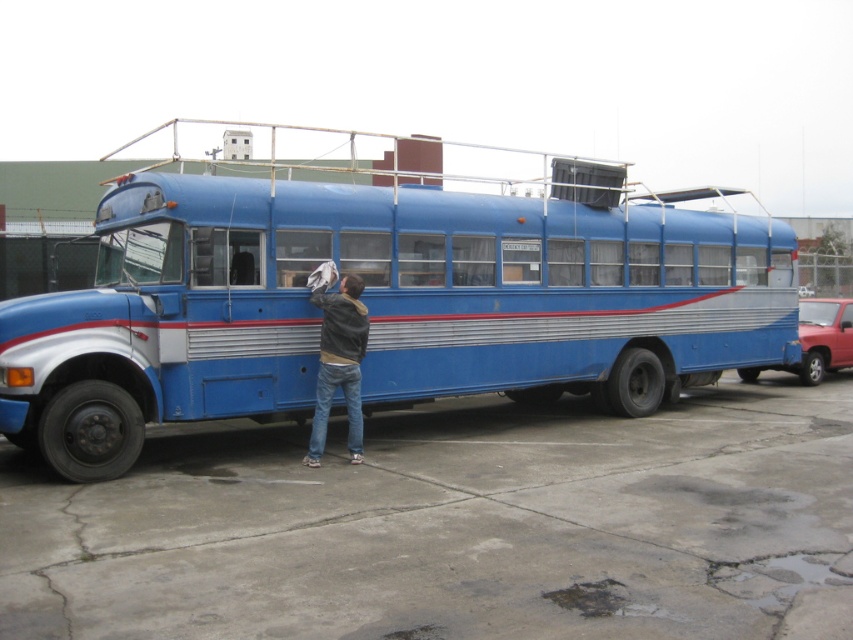
Is point (207, 515) positioned before point (351, 400)?

Yes, it is in front of point (351, 400).

Can you confirm if concrete at lower center is positioned below jeans at lower center?

Correct, concrete at lower center is located below jeans at lower center.

Is point (663, 509) closer to viewer compared to point (340, 308)?

Yes, point (663, 509) is closer to viewer.

Locate an element on the screen. concrete at lower center is located at coordinates (456, 525).

Does blue metallic bus at center appear over jeans at lower center?

Yes, blue metallic bus at center is above jeans at lower center.

Is blue metallic bus at center closer to camera compared to jeans at lower center?

Yes, it is.

Image resolution: width=853 pixels, height=640 pixels. I want to click on blue metallic bus at center, so click(x=386, y=301).

Does concrete at lower center have a smaller size compared to blue metallic bus at center?

Indeed, concrete at lower center has a smaller size compared to blue metallic bus at center.

Who is taller, concrete at lower center or blue metallic bus at center?

blue metallic bus at center

This screenshot has height=640, width=853. What do you see at coordinates (456, 525) in the screenshot?
I see `concrete at lower center` at bounding box center [456, 525].

Identify the location of concrete at lower center. This screenshot has height=640, width=853. (456, 525).